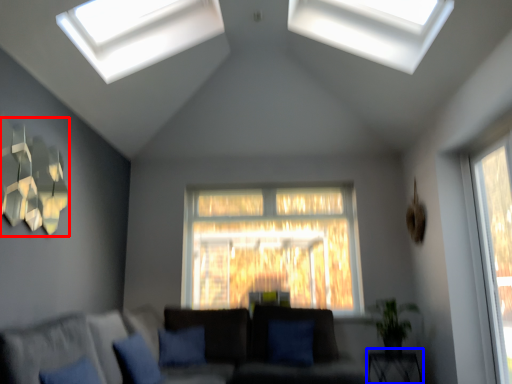
Question: Among these objects, which one is farthest to the camera, lamp (highlighted by a red box) or table (highlighted by a blue box)?

Choices:
 (A) lamp
 (B) table

Answer: (B)